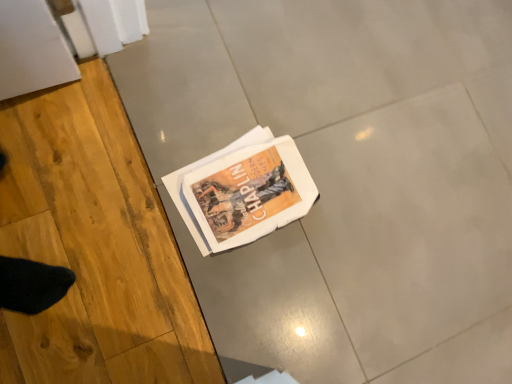
The image size is (512, 384). I want to click on orange paper magazine at center, so click(x=242, y=191).

The image size is (512, 384). What do you see at coordinates (242, 191) in the screenshot?
I see `orange paper magazine at center` at bounding box center [242, 191].

Identify the location of orange paper magazine at center. This screenshot has height=384, width=512. (242, 191).